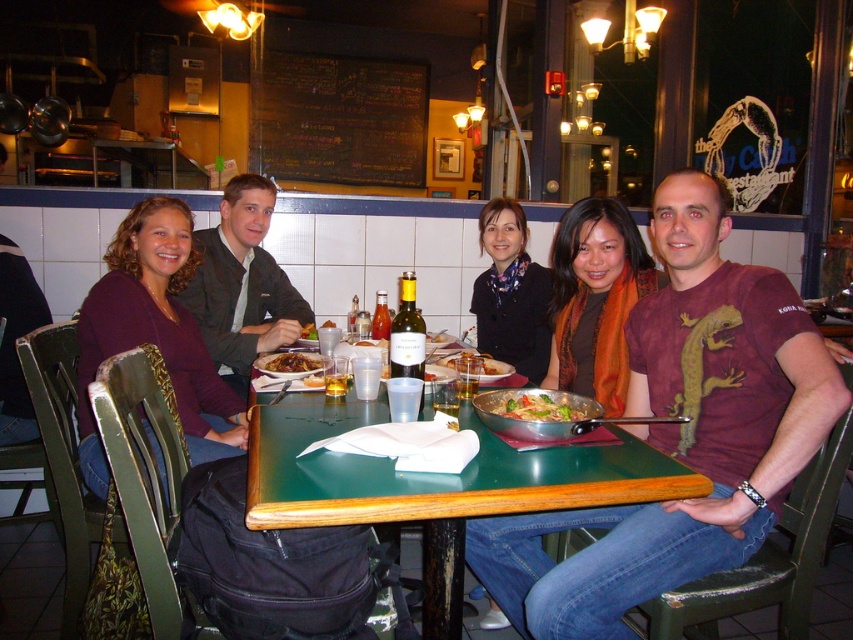
You are a server at the restaurant and need to place a new drink order on the table. The drink requires a coaster that must be smaller than the metallic silver pan at center. Can you place the coaster next to the dark blue scarf at center without overlapping?

The dark blue scarf at center is wider than the metallic silver pan at center. Since the coaster needs to be smaller than the pan, placing it next to the scarf is possible as long as it doesn

You are sitting at the rectangular table in the green table with wooden edge. You want to place a small item on the table. There are two points marked on the table surface. One is at point (x=297, y=518) and the other is at point (x=508, y=404). Which point is closer to you if you are facing the table?

Point (x=297, y=518) is in front of point (x=508, y=404), so it is closer to you when facing the table.

You are standing in the restaurant and want to reach the point marked as point (503, 333). If your walking speed is 1.2 meters per second, how many seconds will it take you to reach that point?

The distance between you and point (503, 333) is 3.12 meters. At a speed of 1.2 meters per second, it will take approximately 2.6 seconds to reach the point.